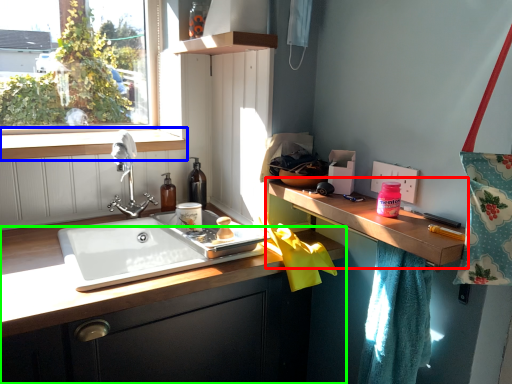
Question: Estimate the real-world distances between objects in this image. Which object is closer to countertop (highlighted by a red box), window sill (highlighted by a blue box) or cabinetry (highlighted by a green box)?

Choices:
 (A) window sill
 (B) cabinetry

Answer: (B)